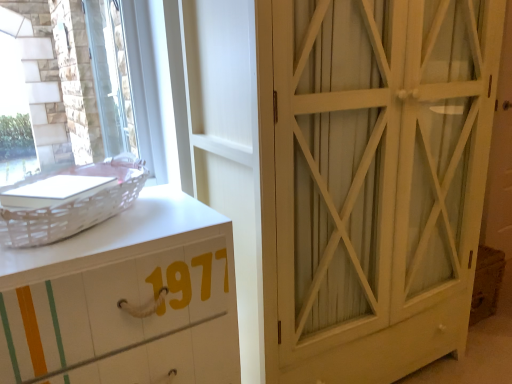
Question: Does white wood cabinet at right come in front of white painted wood chest of drawers at left?

Choices:
 (A) yes
 (B) no

Answer: (B)

Question: Considering the relative sizes of white wood cabinet at right and white painted wood chest of drawers at left in the image provided, is white wood cabinet at right thinner than white painted wood chest of drawers at left?

Choices:
 (A) yes
 (B) no

Answer: (B)

Question: Is white wood cabinet at right facing towards white painted wood chest of drawers at left?

Choices:
 (A) yes
 (B) no

Answer: (B)

Question: Can white painted wood chest of drawers at left be found inside white wood cabinet at right?

Choices:
 (A) no
 (B) yes

Answer: (A)

Question: Is white wood cabinet at right positioned with its back to white painted wood chest of drawers at left?

Choices:
 (A) yes
 (B) no

Answer: (B)

Question: Is the position of white wood cabinet at right more distant than that of white painted wood chest of drawers at left?

Choices:
 (A) no
 (B) yes

Answer: (B)

Question: Is the depth of white wicker basket at left less than that of white wood cabinet at right?

Choices:
 (A) yes
 (B) no

Answer: (A)

Question: Can you confirm if white wicker basket at left is positioned to the left of white wood cabinet at right?

Choices:
 (A) yes
 (B) no

Answer: (A)

Question: From the image's perspective, is white wicker basket at left on white wood cabinet at right?

Choices:
 (A) no
 (B) yes

Answer: (B)

Question: From a real-world perspective, is white wicker basket at left on white wood cabinet at right?

Choices:
 (A) no
 (B) yes

Answer: (B)

Question: From a real-world perspective, is white wicker basket at left located beneath white wood cabinet at right?

Choices:
 (A) yes
 (B) no

Answer: (B)

Question: Is white wicker basket at left surrounding white wood cabinet at right?

Choices:
 (A) yes
 (B) no

Answer: (B)

Question: From a real-world perspective, is clear glass window at upper left physically below white wicker basket at left?

Choices:
 (A) no
 (B) yes

Answer: (A)